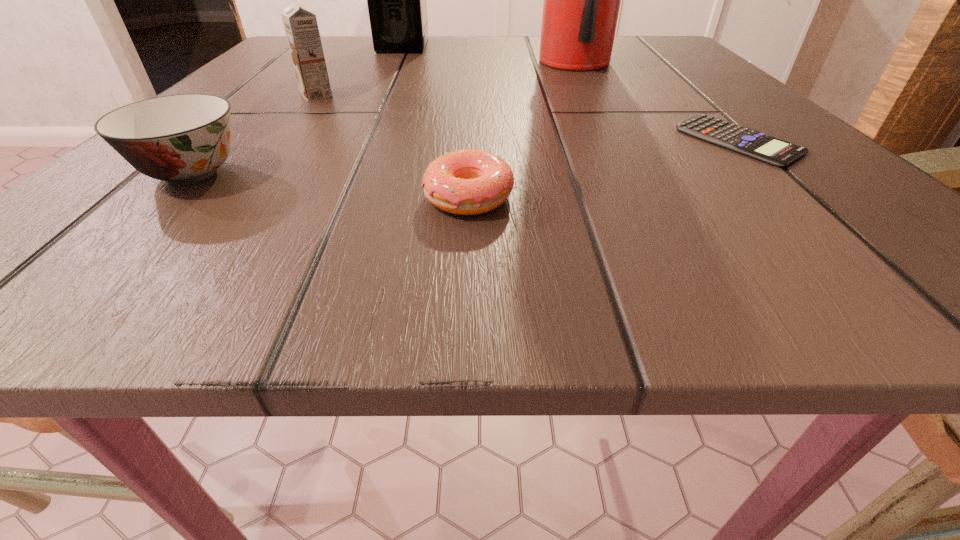
The image size is (960, 540). Find the location of `soup bowl located in the left edge section of the desktop`. soup bowl located in the left edge section of the desktop is located at coordinates (183, 139).

Identify the location of fire extinguisher that is at the right edge. (581, 5).

The width and height of the screenshot is (960, 540). Find the location of `calculator positioned at the right edge`. calculator positioned at the right edge is located at coordinates (753, 143).

At what (x,y) coordinates should I click in order to perform the action: click on object positioned at the far right corner. Please return your answer as a coordinate pair (x, y). This screenshot has height=540, width=960. Looking at the image, I should click on (581, 5).

Locate an element on the screen. vacant position at the left edge of the desktop is located at coordinates (243, 163).

At what (x,y) coordinates should I click in order to perform the action: click on free spot at the right edge of the desktop. Please return your answer as a coordinate pair (x, y). This screenshot has width=960, height=540. Looking at the image, I should click on (676, 90).

The height and width of the screenshot is (540, 960). In the image, there is a desktop. Find the location of `vacant space at the near left corner`. vacant space at the near left corner is located at coordinates (193, 228).

This screenshot has height=540, width=960. I want to click on free space at the far right corner, so click(x=622, y=52).

This screenshot has width=960, height=540. I want to click on unoccupied area between the fourth object from left to right and the fourth object from right to left, so click(435, 122).

Locate an element on the screen. vacant area between the third farthest object and the second tallest object is located at coordinates (360, 71).